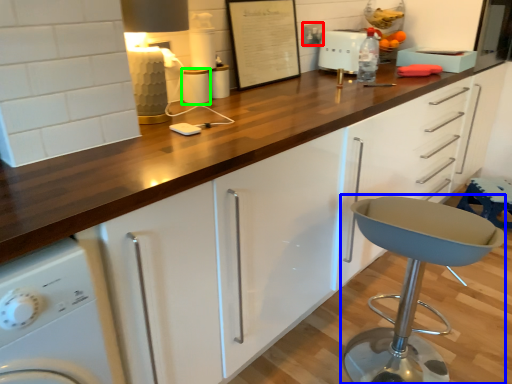
Question: Which object is positioned closest to electric outlet (highlighted by a red box)? Select from stool (highlighted by a blue box) and appliance (highlighted by a green box).

Choices:
 (A) stool
 (B) appliance

Answer: (B)